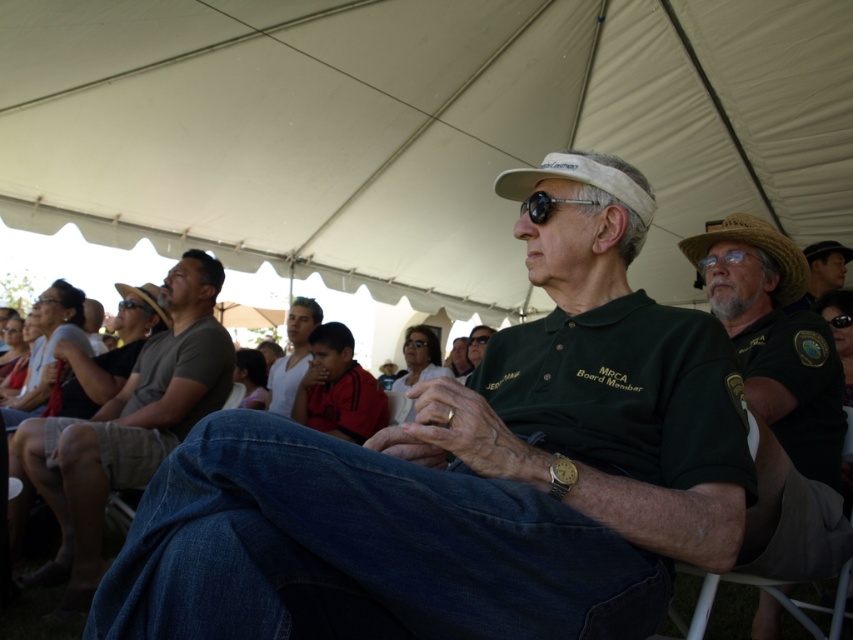
Which is more to the right, white fabric canopy at upper center or green straw hat at right?

green straw hat at right is more to the right.

Does white fabric canopy at upper center have a larger size compared to green straw hat at right?

Indeed, white fabric canopy at upper center has a larger size compared to green straw hat at right.

This screenshot has height=640, width=853. In order to click on white fabric canopy at upper center in this screenshot , I will do `click(416, 125)`.

Find the location of a particular element. The height and width of the screenshot is (640, 853). white fabric canopy at upper center is located at coordinates (416, 125).

Is green straw hat at right further to camera compared to brown straw cowboy hat at right?

That is False.

Who is higher up, green straw hat at right or brown straw cowboy hat at right?

brown straw cowboy hat at right is higher up.

Between point (822, 416) and point (767, 232), which one is positioned behind?

The point (767, 232) is more distant.

Locate an element on the screen. This screenshot has width=853, height=640. green straw hat at right is located at coordinates (775, 339).

Which is more to the right, brown straw cowboy hat at right or matte black sunglasses at center?

brown straw cowboy hat at right is more to the right.

Is brown straw cowboy hat at right to the right of matte black sunglasses at center from the viewer's perspective?

Yes, brown straw cowboy hat at right is to the right of matte black sunglasses at center.

Identify the location of brown straw cowboy hat at right. (756, 248).